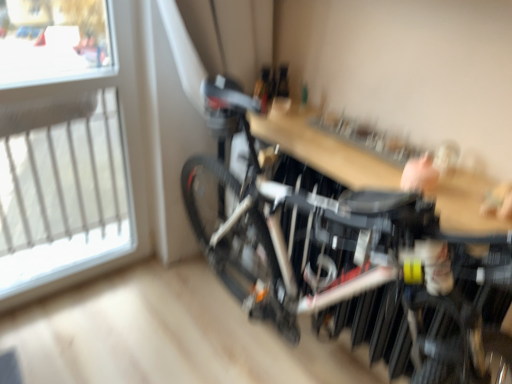
This screenshot has height=384, width=512. Find the location of `vacant area in front of transparent glass window at upper left`. vacant area in front of transparent glass window at upper left is located at coordinates (67, 336).